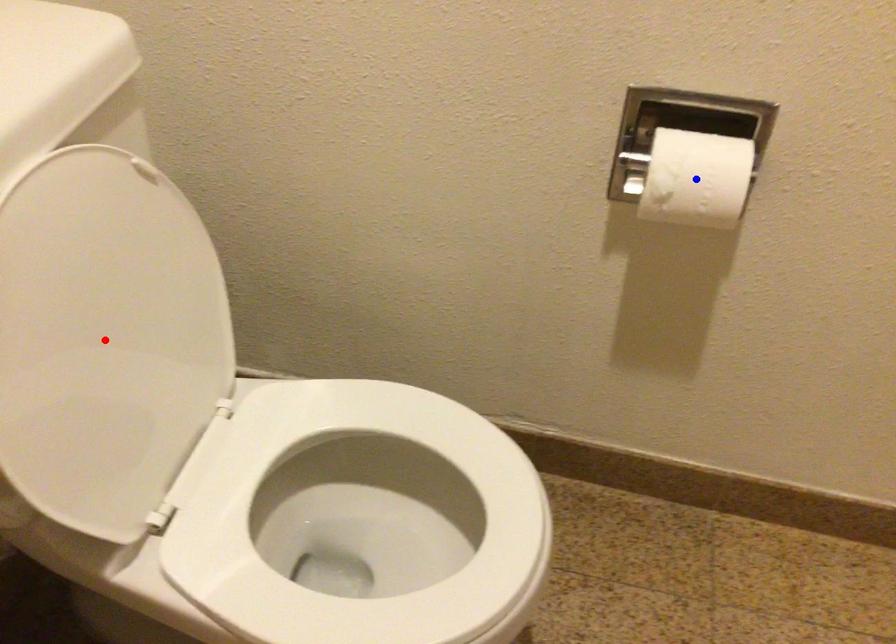
Question: Two points are marked on the image. Which point is closer to the camera?

Choices:
 (A) Blue point is closer.
 (B) Red point is closer.

Answer: (B)